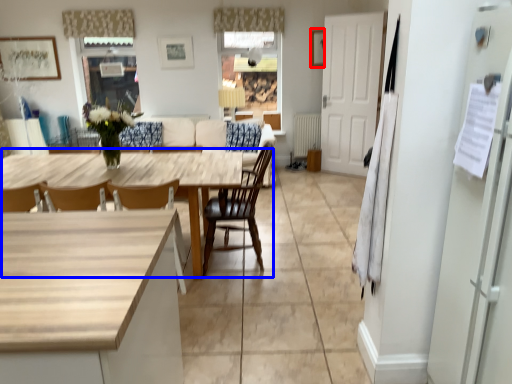
Question: Which point is closer to the camera, picture frame (highlighted by a red box) or kitchen & dining room table (highlighted by a blue box)?

Choices:
 (A) picture frame
 (B) kitchen & dining room table

Answer: (B)